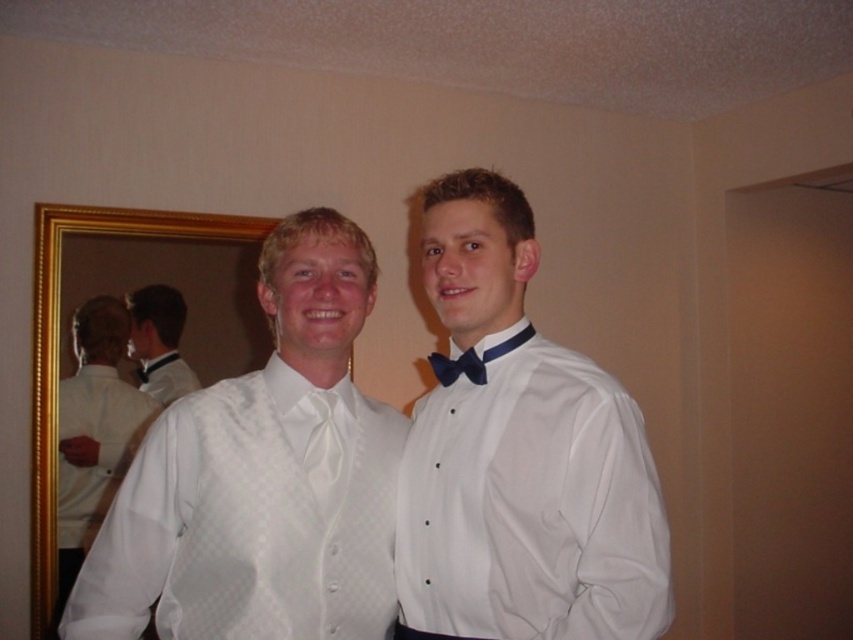
Question: Is white satin shirt at center further to the viewer compared to blue satin bow tie at center?

Choices:
 (A) yes
 (B) no

Answer: (B)

Question: Which point is farther to the camera?

Choices:
 (A) (149, 346)
 (B) (318, 432)
 (C) (109, 560)
 (D) (529, 221)

Answer: (A)

Question: Is white satin shirt at left to the right of white satin bow tie at left from the viewer's perspective?

Choices:
 (A) no
 (B) yes

Answer: (A)

Question: Which object appears closest to the camera in this image?

Choices:
 (A) gold-framed mirror at left
 (B) blue satin bow tie at center
 (C) white satin shirt at center
 (D) white satin bow tie at center

Answer: (C)

Question: Can you confirm if white satin shirt at left is wider than white satin bow tie at left?

Choices:
 (A) no
 (B) yes

Answer: (B)

Question: Which object appears farthest from the camera in this image?

Choices:
 (A) white satin shirt at center
 (B) blue satin bow tie at center

Answer: (B)